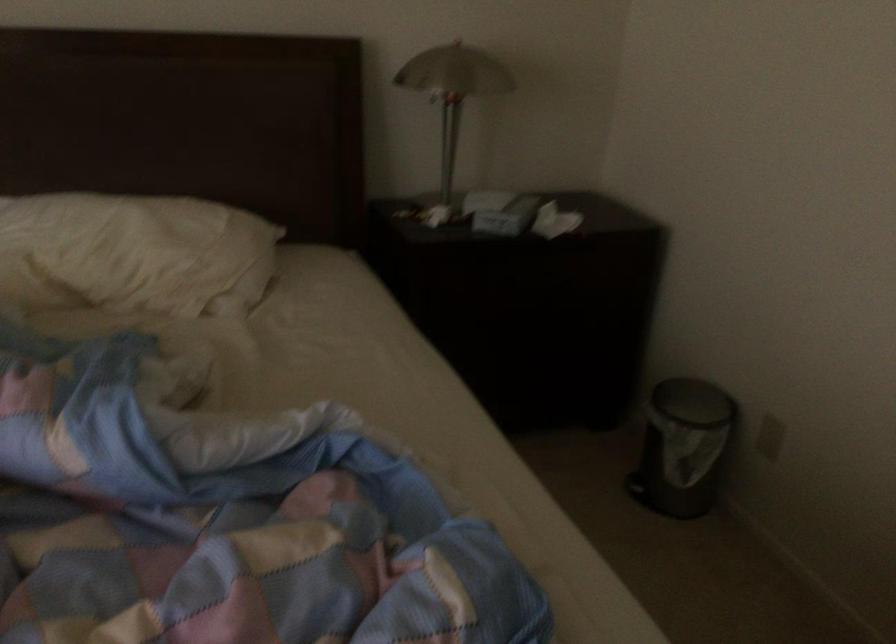
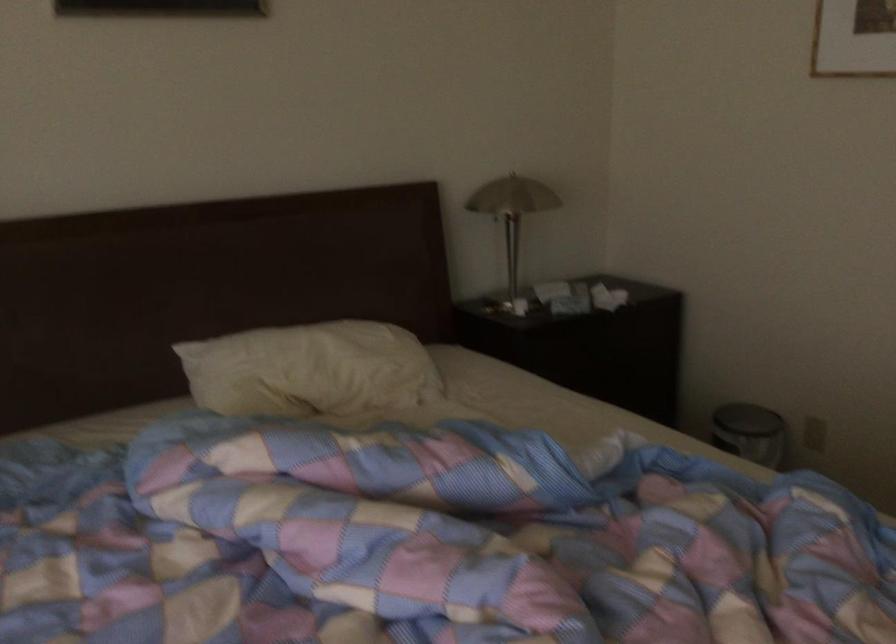
Locate, in the second image, the point that corresponds to [679,422] in the first image.

(748, 431)